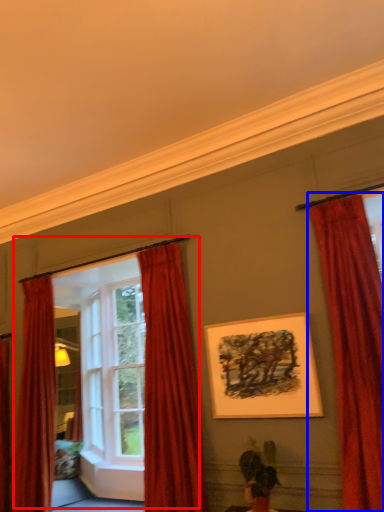
Question: Among these objects, which one is farthest to the camera, window frame (highlighted by a red box) or curtain (highlighted by a blue box)?

Choices:
 (A) window frame
 (B) curtain

Answer: (A)